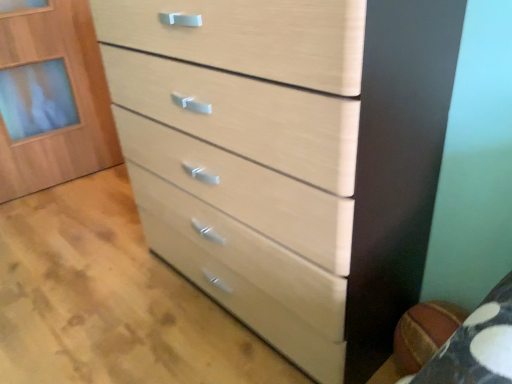
Where is `blank area to the left of light wood/texture chest of drawers at center`? This screenshot has width=512, height=384. blank area to the left of light wood/texture chest of drawers at center is located at coordinates (103, 291).